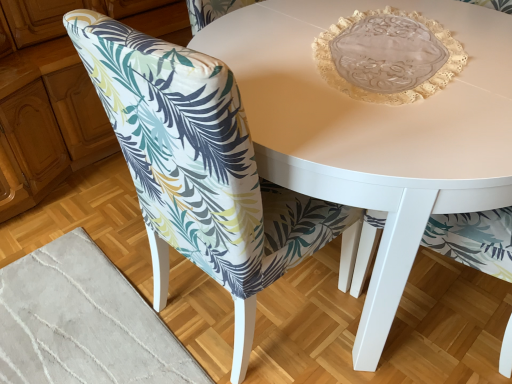
What are the coordinates of `white glossy table at center` in the screenshot? It's located at (374, 131).

What do you see at coordinates (374, 131) in the screenshot? The image size is (512, 384). I see `white glossy table at center` at bounding box center [374, 131].

This screenshot has height=384, width=512. Identify the location of printed fabric chair at lower left. (199, 168).

This screenshot has height=384, width=512. Describe the element at coordinates (199, 168) in the screenshot. I see `printed fabric chair at lower left` at that location.

What is the approximate height of printed fabric chair at lower left?

It is 38.46 inches.

Identify the location of white glossy table at center. Image resolution: width=512 pixels, height=384 pixels. (374, 131).

Which object is positioned more to the right, printed fabric chair at lower left or white glossy table at center?

white glossy table at center is more to the right.

Is printed fabric chair at lower left in front of or behind white glossy table at center in the image?

printed fabric chair at lower left is in front of white glossy table at center.

Based on the photo, which is farther from the camera, (127, 145) or (344, 111)?

The point (127, 145) is behind.

From the image's perspective, does printed fabric chair at lower left appear higher than white glossy table at center?

No.

From a real-world perspective, which is physically below, printed fabric chair at lower left or white glossy table at center?

white glossy table at center, from a real-world perspective.

In terms of width, does printed fabric chair at lower left look wider or thinner when compared to white glossy table at center?

Clearly, printed fabric chair at lower left has less width compared to white glossy table at center.

Can you confirm if printed fabric chair at lower left is taller than white glossy table at center?

Yes.

Looking at this image, which of these two, printed fabric chair at lower left or white glossy table at center, is bigger?

white glossy table at center is bigger.

Would you say printed fabric chair at lower left is inside or outside white glossy table at center?

The correct answer is: inside.

Is printed fabric chair at lower left directly adjacent to white glossy table at center?

No, printed fabric chair at lower left is not with white glossy table at center.

Is printed fabric chair at lower left looking in the opposite direction of white glossy table at center?

Correct, printed fabric chair at lower left is looking away from white glossy table at center.

You are a GUI agent. You are given a task and a screenshot of the screen. Output one action in this format:
    pyautogui.click(x=<x>, y=<y>)
    Task: Click on the coffee table located above the printed fabric chair at lower left (from the image's perspective)
    
    Given the screenshot: What is the action you would take?
    pyautogui.click(x=374, y=131)

Can you confirm if white glossy table at center is positioned to the left of printed fabric chair at lower left?

Incorrect, white glossy table at center is not on the left side of printed fabric chair at lower left.

Is white glossy table at center in front of or behind printed fabric chair at lower left in the image?

white glossy table at center is behind printed fabric chair at lower left.

Is point (417, 107) farther from camera compared to point (287, 234)?

No, (417, 107) is in front of (287, 234).

From the image's perspective, is white glossy table at center above or below printed fabric chair at lower left?

white glossy table at center is above printed fabric chair at lower left.

From a real-world perspective, between white glossy table at center and printed fabric chair at lower left, who is vertically higher?

→ printed fabric chair at lower left is physically above.

Looking at their sizes, would you say white glossy table at center is wider or thinner than printed fabric chair at lower left?

Clearly, white glossy table at center has more width compared to printed fabric chair at lower left.

From their relative heights in the image, would you say white glossy table at center is taller or shorter than printed fabric chair at lower left?

In the image, white glossy table at center appears to be shorter than printed fabric chair at lower left.

Which of these two, white glossy table at center or printed fabric chair at lower left, is bigger?

With larger size is white glossy table at center.

Is white glossy table at center completely or partially outside of printed fabric chair at lower left?

Yes, white glossy table at center is not within printed fabric chair at lower left.

Is white glossy table at center placed right next to printed fabric chair at lower left?

white glossy table at center and printed fabric chair at lower left are not in contact.

Is white glossy table at center oriented away from printed fabric chair at lower left?

No, white glossy table at center is not facing the opposite direction of printed fabric chair at lower left.

Find the location of a particular element. coffee table on the right of printed fabric chair at lower left is located at coordinates (x=374, y=131).

At what (x,y) coordinates should I click in order to perform the action: click on coffee table that appears behind the printed fabric chair at lower left. Please return your answer as a coordinate pair (x, y). This screenshot has width=512, height=384. Looking at the image, I should click on (374, 131).

At what (x,y) coordinates should I click in order to perform the action: click on chair located in front of the white glossy table at center. Please return your answer as a coordinate pair (x, y). The image size is (512, 384). Looking at the image, I should click on (199, 168).